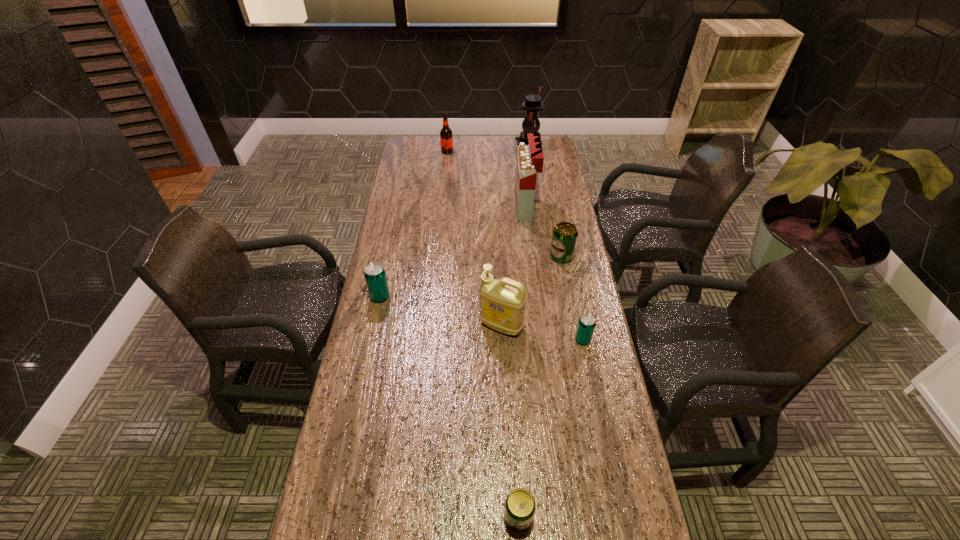
Where is `lantern`? Image resolution: width=960 pixels, height=540 pixels. lantern is located at coordinates [532, 104].

The height and width of the screenshot is (540, 960). Find the location of `the sixth nearest object`. the sixth nearest object is located at coordinates (530, 158).

Where is `red cigarette case`? The height and width of the screenshot is (540, 960). red cigarette case is located at coordinates (530, 158).

At what (x,y) coordinates should I click in order to perform the action: click on the sixth shortest object. Please return your answer as a coordinate pair (x, y). Looking at the image, I should click on [502, 302].

Identify the location of detergent. (502, 302).

At what (x,y) coordinates should I click in order to perform the action: click on the second object from left to right. Please return your answer as a coordinate pair (x, y). The image size is (960, 540). Looking at the image, I should click on (446, 136).

Locate an element on the screen. This screenshot has width=960, height=540. root beer is located at coordinates click(446, 136).

In order to click on the fourth farthest object in this screenshot , I will do `click(564, 237)`.

Where is `the right green beer can`? The height and width of the screenshot is (540, 960). the right green beer can is located at coordinates (564, 237).

The width and height of the screenshot is (960, 540). I want to click on the bigger teal beer can, so 375,276.